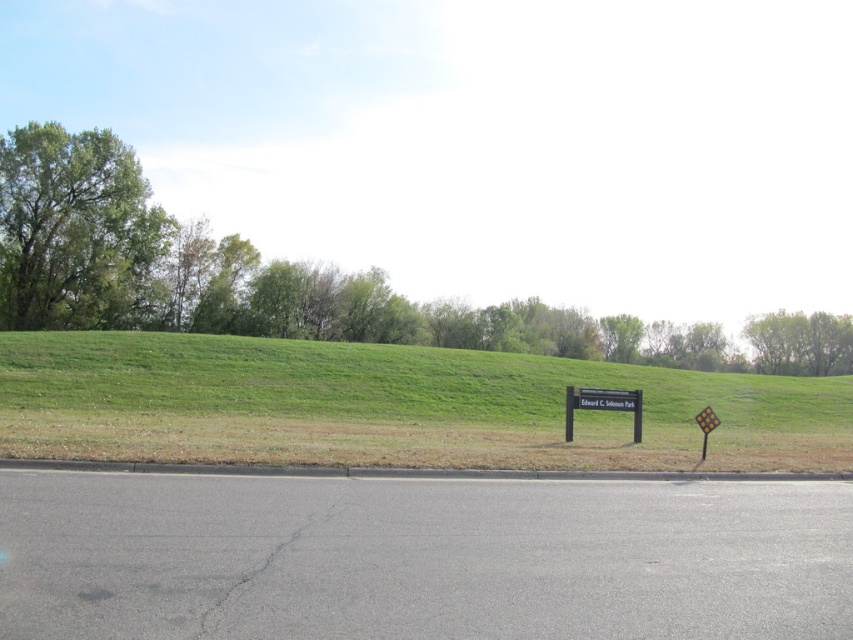
Question: From the image, what is the correct spatial relationship of green leafy tree at left in relation to yellow reflective plastic at right?

Choices:
 (A) left
 (B) right

Answer: (A)

Question: Can you confirm if green leafy tree at left is positioned to the left of green leafy tree at upper right?

Choices:
 (A) no
 (B) yes

Answer: (B)

Question: Can you confirm if green grassy hillside at center is wider than black plastic sign at center?

Choices:
 (A) no
 (B) yes

Answer: (B)

Question: Estimate the real-world distances between objects in this image. Which object is closer to the green leafy tree at upper right?

Choices:
 (A) green grassy hillside at center
 (B) black plastic sign at center
 (C) yellow reflective plastic at right

Answer: (A)

Question: Among these objects, which one is nearest to the camera?

Choices:
 (A) green leafy tree at upper left
 (B) black plastic sign at center
 (C) green leafy tree at upper right

Answer: (B)

Question: Which object appears closest to the camera in this image?

Choices:
 (A) green leafy tree at upper left
 (B) green grassy hillside at center

Answer: (B)